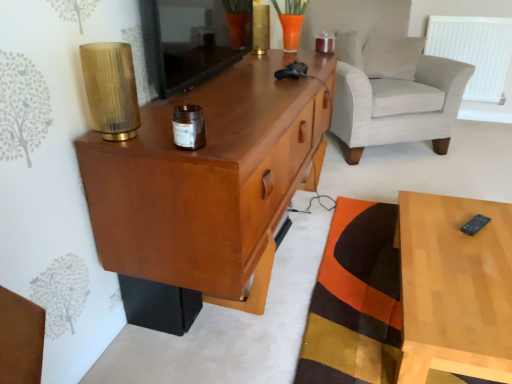
Question: Considering the positions of shiny metallic candle at upper center, the first candle holder from the back, and orange patchwork mat at lower right in the image, is shiny metallic candle at upper center, the first candle holder from the back, wider or thinner than orange patchwork mat at lower right?

Choices:
 (A) thin
 (B) wide

Answer: (A)

Question: In the image, is shiny metallic candle at upper center, the first candle holder from the back, on the left side or the right side of orange patchwork mat at lower right?

Choices:
 (A) right
 (B) left

Answer: (B)

Question: Estimate the real-world distances between objects in this image. Which object is farther from the orange patchwork mat at lower right?

Choices:
 (A) smooth wooden mirror at upper center
 (B) translucent bamboo lamp at upper left
 (C) white plastic radiator at upper right
 (D) light brown wood at right
 (E) white textured pillow at upper right

Answer: (C)

Question: Estimate the real-world distances between objects in this image. Which object is farther from the white plastic radiator at upper right?

Choices:
 (A) translucent bamboo lamp at upper left
 (B) matte wood cabinet at left
 (C) brown glass jar at center, the second candle holder when ordered from top to bottom
 (D) white textured pillow at upper right
 (E) white striped fabric armchair at upper right

Answer: (A)